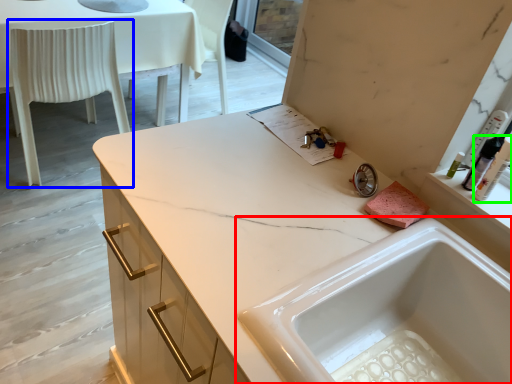
Question: Estimate the real-world distances between objects in this image. Which object is closer to sink (highlighted by a red box), chair (highlighted by a blue box) or toiletry (highlighted by a green box)?

Choices:
 (A) chair
 (B) toiletry

Answer: (B)